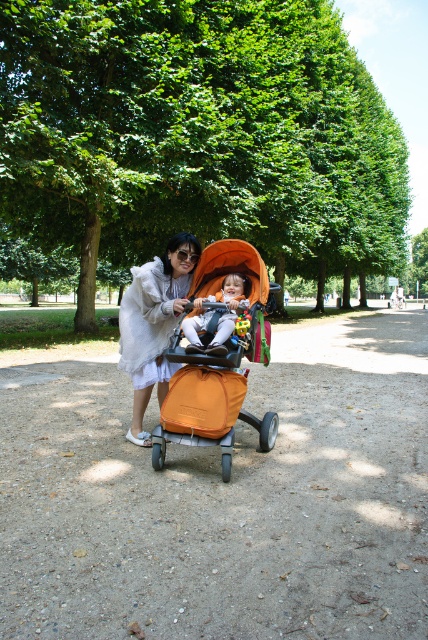
Is white fluffy coat at center thinner than soft orange stroller at center?

Incorrect, white fluffy coat at center's width is not less than soft orange stroller at center's.

The height and width of the screenshot is (640, 428). Find the location of `white fluffy coat at center`. white fluffy coat at center is located at coordinates (154, 323).

Find the location of a particular element. Image resolution: width=428 pixels, height=640 pixels. white fluffy coat at center is located at coordinates (154, 323).

Is point (243, 394) positioned in front of point (222, 337)?

No, (243, 394) is further to viewer.

Which of these two, orange fabric baby carriage at center or soft orange stroller at center, stands taller?

Standing taller between the two is orange fabric baby carriage at center.

In the scene shown: Who is more distant from viewer, (225, 428) or (223, 288)?

Point (223, 288)

You are a GUI agent. You are given a task and a screenshot of the screen. Output one action in this format:
    pyautogui.click(x=<x>, y=<y>)
    Task: Click on the orange fabric baby carriage at center
    
    Given the screenshot: What is the action you would take?
    pyautogui.click(x=217, y=356)

Is point (174, 349) behind point (139, 304)?

No, it is in front of (139, 304).

Identify the location of orange fabric baby carriage at center. This screenshot has height=640, width=428. (217, 356).